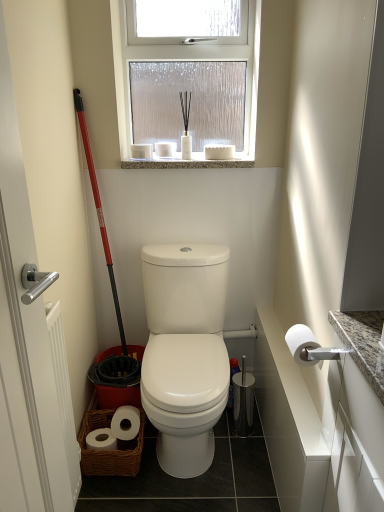
What do you see at coordinates (185, 352) in the screenshot? I see `white glossy toilet at center` at bounding box center [185, 352].

Find the location of a particular element. The height and width of the screenshot is (512, 384). frosted glass window at upper center is located at coordinates (189, 78).

What is the approximate width of frosted glass window at upper center?

frosted glass window at upper center is 11.35 centimeters in width.

Where is `white glossy toilet at center`? This screenshot has height=512, width=384. white glossy toilet at center is located at coordinates (185, 352).

Considering the sizes of frosted glass window at upper center and white glossy toilet at center in the image, is frosted glass window at upper center taller or shorter than white glossy toilet at center?

Clearly, frosted glass window at upper center is taller compared to white glossy toilet at center.

Which object is positioned more to the left, frosted glass window at upper center or white glossy toilet at center?

frosted glass window at upper center is more to the left.

Is the depth of frosted glass window at upper center less than that of white glossy toilet at center?

No, frosted glass window at upper center is behind white glossy toilet at center.

Does white matte toilet paper at right have a greater height compared to white glossy toilet at center?

In fact, white matte toilet paper at right may be shorter than white glossy toilet at center.

Is white matte toilet paper at right looking in the opposite direction of white glossy toilet at center?

That's not correct — white matte toilet paper at right is not looking away from white glossy toilet at center.

Who is bigger, white matte toilet paper at right or white glossy toilet at center?

white glossy toilet at center.

Based on the photo, from the image's perspective, which is below, white matte toilet paper at right or white glossy toilet at center?

white glossy toilet at center appears lower in the image.

At what (x,y) coordinates should I click in order to perform the action: click on toilet paper that is below the frosted glass window at upper center (from the image's perspective). Please return your answer as a coordinate pair (x, y). The height and width of the screenshot is (512, 384). Looking at the image, I should click on (303, 345).

Visually, is frosted glass window at upper center positioned to the left or to the right of white matte toilet paper at right?

In the image, frosted glass window at upper center appears on the left side of white matte toilet paper at right.

Considering the relative sizes of frosted glass window at upper center and white matte toilet paper at right in the image provided, is frosted glass window at upper center smaller than white matte toilet paper at right?

No, frosted glass window at upper center is not smaller than white matte toilet paper at right.

In the scene shown: From the image's perspective, between frosted glass window at upper center and white matte toilet paper at right, who is located below?

white matte toilet paper at right appears lower in the image.

Is frosted glass window at upper center at the back of white matte toilet paper at right?

white matte toilet paper at right is not turned away from frosted glass window at upper center.

Consider the image. Based on their sizes in the image, would you say white matte toilet paper at right is bigger or smaller than frosted glass window at upper center?

In the image, white matte toilet paper at right appears to be smaller than frosted glass window at upper center.

Looking at this image, would you say white matte toilet paper at right contains frosted glass window at upper center?

Actually, frosted glass window at upper center is outside white matte toilet paper at right.

Between white glossy toilet at center and frosted glass window at upper center, which one has larger size?

white glossy toilet at center is bigger.

Is white glossy toilet at center placed right next to frosted glass window at upper center?

No, white glossy toilet at center is not next to frosted glass window at upper center.

Is the depth of white glossy toilet at center greater than that of frosted glass window at upper center?

No, the depth of white glossy toilet at center is less than that of frosted glass window at upper center.

From a real-world perspective, which is physically above, white glossy toilet at center or white matte toilet paper at right?

white matte toilet paper at right, from a real-world perspective.

Find the location of a particular element. toilet that is on the left side of white matte toilet paper at right is located at coordinates (185, 352).

Is white glossy toilet at center not near white matte toilet paper at right?

No.

At what (x,y) coordinates should I click in order to perform the action: click on toilet in front of the frosted glass window at upper center. Please return your answer as a coordinate pair (x, y). This screenshot has height=512, width=384. Looking at the image, I should click on (185, 352).

This screenshot has height=512, width=384. Identify the location of toilet below the white matte toilet paper at right (from a real-world perspective). (185, 352).

When comparing their distances from white matte toilet paper at right, does white glossy toilet at center or frosted glass window at upper center seem closer?

white glossy toilet at center is positioned closer to the anchor white matte toilet paper at right.

Which object lies nearer to the anchor point frosted glass window at upper center, white glossy toilet at center or white matte toilet paper at right?

Among the two, white glossy toilet at center is located nearer to frosted glass window at upper center.

In the scene shown: When comparing their distances from white glossy toilet at center, does frosted glass window at upper center or white matte toilet paper at right seem further?

frosted glass window at upper center is positioned further to the anchor white glossy toilet at center.

Based on their spatial positions, is white matte toilet paper at right or white glossy toilet at center closer to frosted glass window at upper center?

white glossy toilet at center is positioned closer to the anchor frosted glass window at upper center.

Which object lies further to the anchor point white glossy toilet at center, white matte toilet paper at right or frosted glass window at upper center?

frosted glass window at upper center.

From the image, which object appears to be nearer to white matte toilet paper at right, frosted glass window at upper center or white glossy toilet at center?

Based on the image, white glossy toilet at center appears to be nearer to white matte toilet paper at right.

Find the location of a particular element. This screenshot has height=512, width=384. toilet paper between frosted glass window at upper center and white glossy toilet at center vertically is located at coordinates (303, 345).